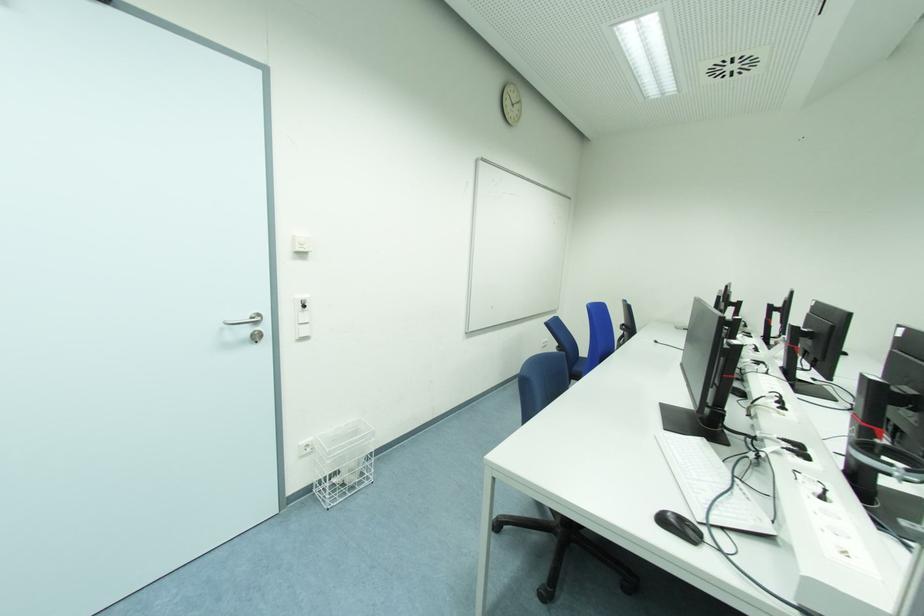
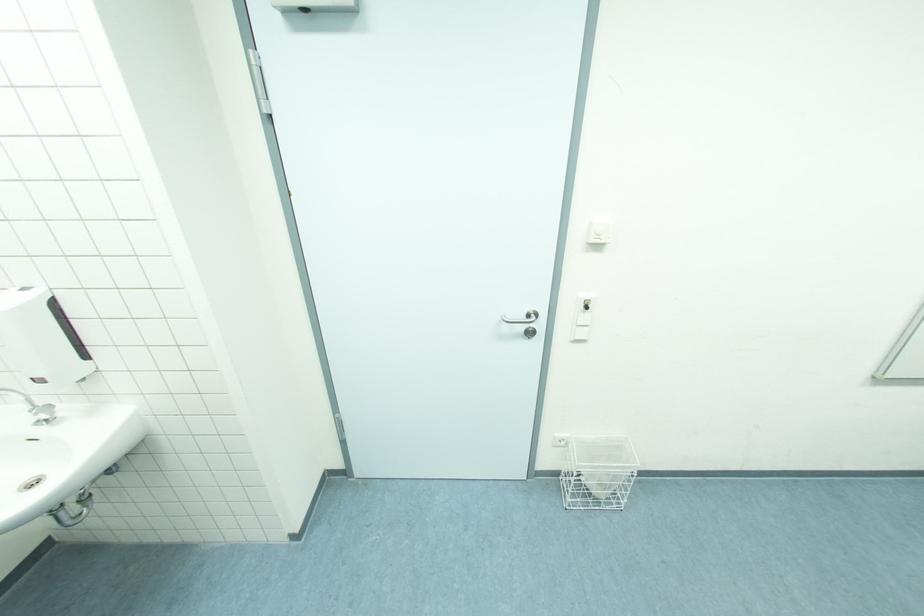
Locate, in the second image, the point that corresponds to the point at 258,333 in the first image.

(532, 329)